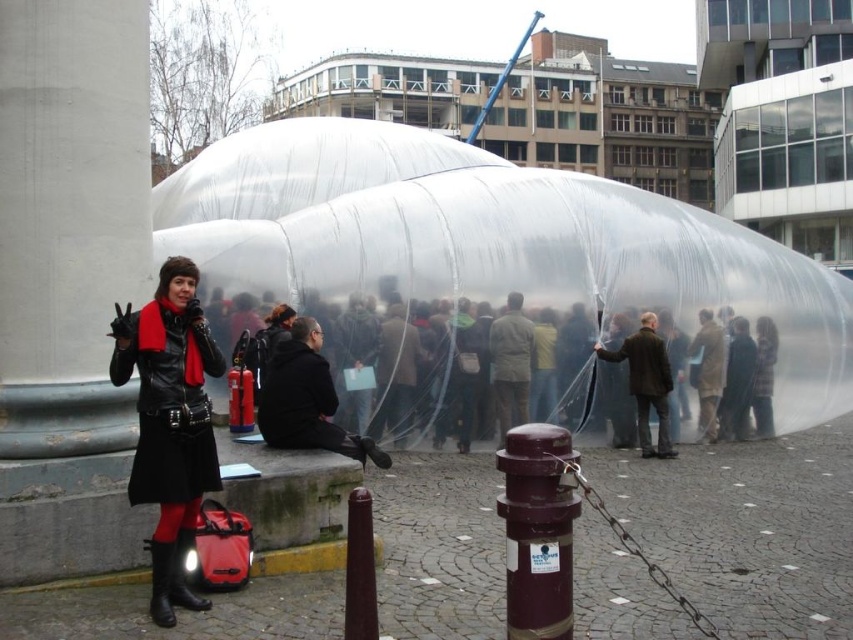
Who is shorter, matte black coat at center or matte black coat at left?

matte black coat at center is shorter.

Does matte black coat at center have a lesser width compared to matte black coat at left?

Incorrect, matte black coat at center's width is not less than matte black coat at left's.

Identify the location of matte black coat at center. The image size is (853, 640). (538, 371).

Where is `matte black coat at center`? This screenshot has width=853, height=640. matte black coat at center is located at coordinates (538, 371).

How much distance is there between transparent plastic sculpture at center and matte black coat at left?

They are 19.09 meters apart.

Between transparent plastic sculpture at center and matte black coat at left, which one has less height?

Standing shorter between the two is matte black coat at left.

Identify the location of transparent plastic sculpture at center. This screenshot has height=640, width=853. (490, 243).

Does transparent plastic sculpture at center have a lesser height compared to maroon metallic hydrant at center?

In fact, transparent plastic sculpture at center may be taller than maroon metallic hydrant at center.

Is transparent plastic sculpture at center positioned at the back of maroon metallic hydrant at center?

Yes, it is.

Who is more distant from viewer, [376,157] or [520,564]?

Point [376,157]

The width and height of the screenshot is (853, 640). Identify the location of transparent plastic sculpture at center. (490, 243).